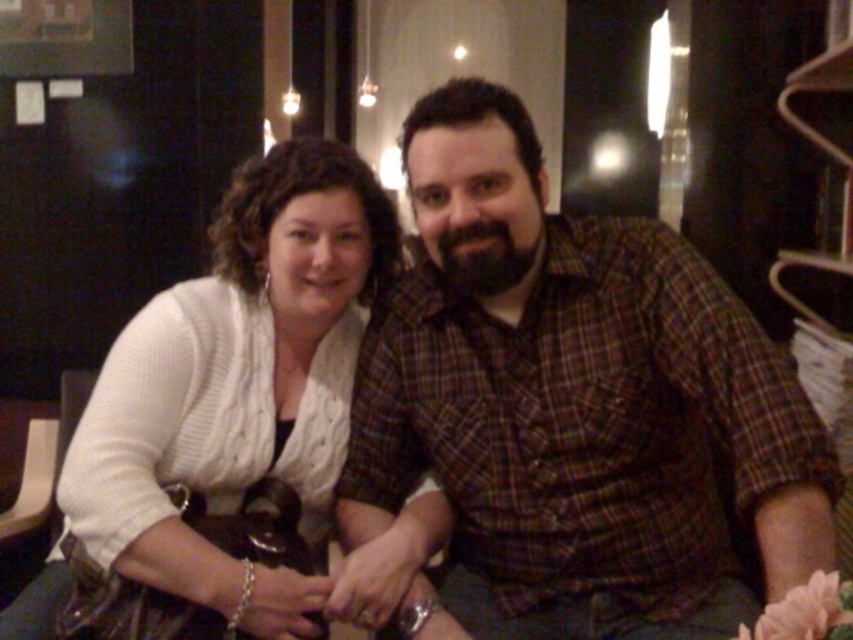
From the picture: You are a photographer trying to capture a candid shot of both the plaid shirt at center and the white knitted sweater at center. Since you want to ensure both are visible in the frame, which clothing item should you focus on first to make sure the other is still in the background?

You should focus on the plaid shirt at center first because it is in front of the white knitted sweater at center, so by focusing on the front item, the background item will still be visible behind it.

You are a photographer trying to capture the perfect shot of the scene. You notice a point at coordinates (577, 404). What object is located at this point?

The point at coordinates (577, 404) indicates the plaid shirt at center.